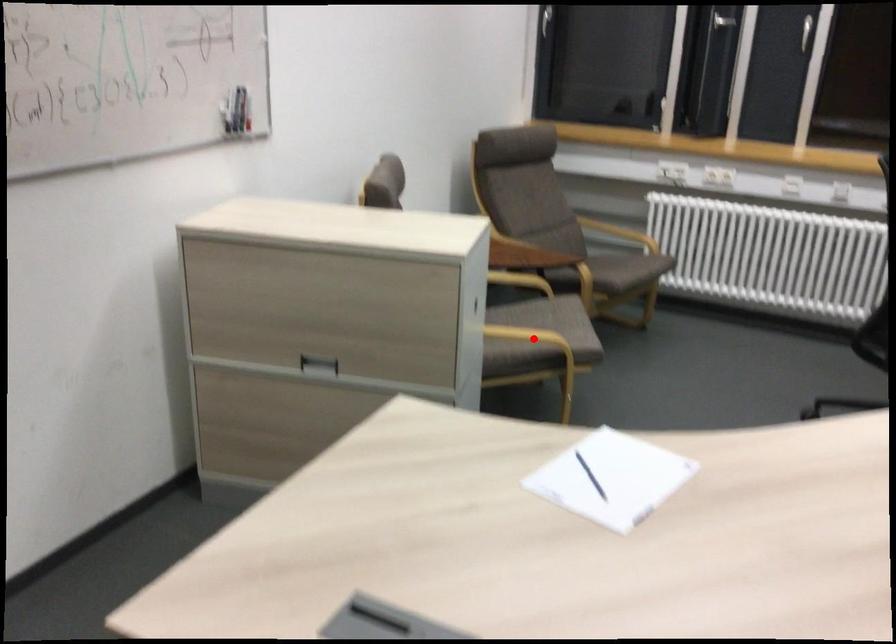
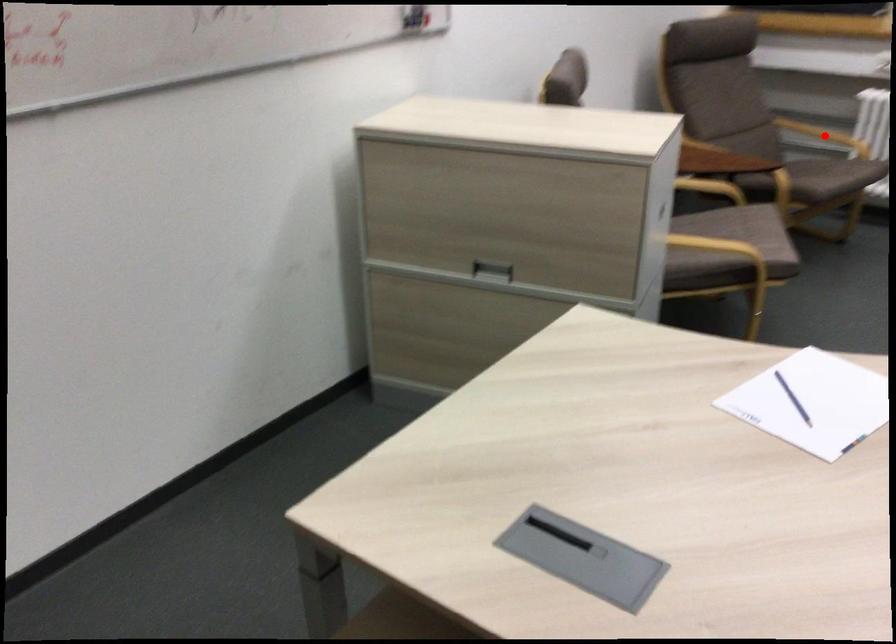
I am providing you with two images of the same scene from different viewpoints. A red point is marked on the first image and another point is marked on the second image. Do the highlighted points in image1 and image2 indicate the same real-world spot?

No